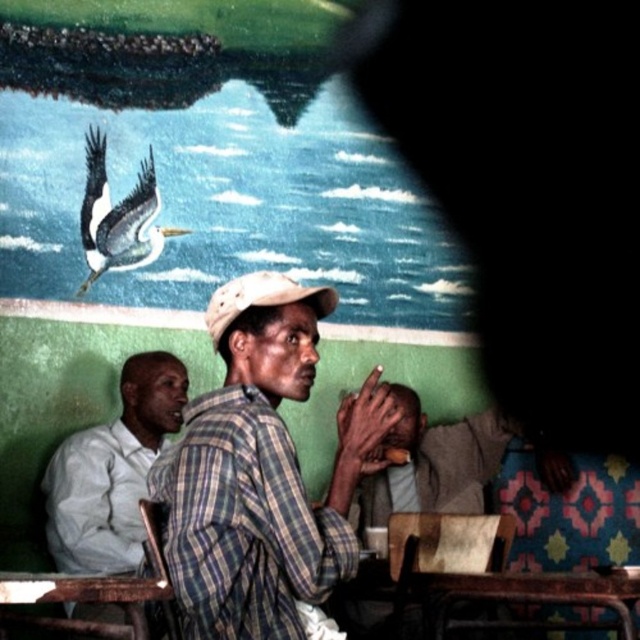
Consider the image. You are a waiter standing at the counter, which is 2 meters away from the plaid fabric shirt at center. If you want to serve this customer, can you reach them without moving closer?

The plaid fabric shirt at center and viewer are 2.34 meters apart. Since you are 2 meters away, you are close enough to reach them without moving closer.

You are taking a photo of the scene and want to focus on both point (160,358) and point (113,257). Since the camera can only focus on one depth, which point should you focus on to ensure the closer one is sharp?

You should focus on point (160,358) because it is closer to the camera than point (113,257). This ensures the closer point remains sharp.